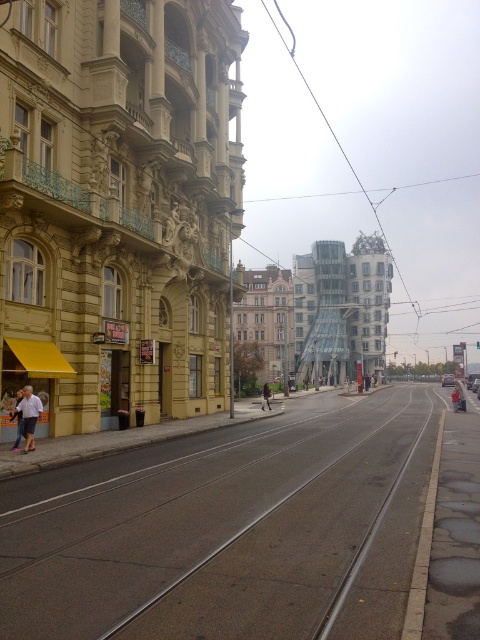
Is dark brown leather jacket at center further to the viewer compared to light blue denim jacket at center?

That is True.

Based on the photo, which of these two, dark brown leather jacket at center or light blue denim jacket at center, stands shorter?

With less height is dark brown leather jacket at center.

The height and width of the screenshot is (640, 480). Identify the location of dark brown leather jacket at center. (265, 396).

Looking at this image, can you confirm if black asphalt train track at center is bigger than dark brown leather jacket at center?

Correct, black asphalt train track at center is larger in size than dark brown leather jacket at center.

Describe the element at coordinates (228, 532) in the screenshot. This screenshot has height=640, width=480. I see `black asphalt train track at center` at that location.

Locate an element on the screen. This screenshot has height=640, width=480. black asphalt train track at center is located at coordinates (228, 532).

Can you confirm if white shirt at left is smaller than dark brown leather jacket at center?

Indeed, white shirt at left has a smaller size compared to dark brown leather jacket at center.

Which is behind, point (23, 433) or point (262, 392)?

Point (262, 392)

Locate an element on the screen. This screenshot has height=640, width=480. white shirt at left is located at coordinates (26, 417).